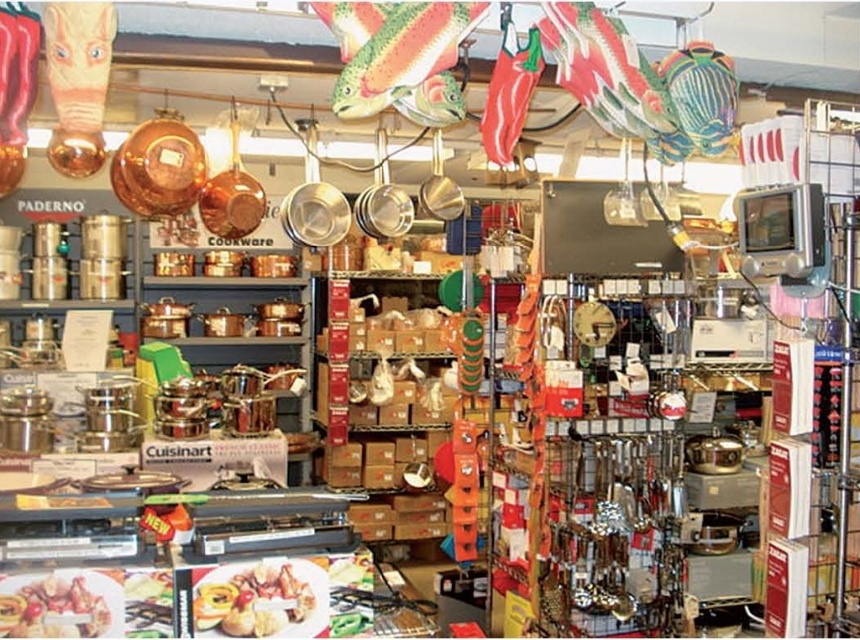
From the picture: You are a customer in the kitchenware store and want to pick up both the golden brown bread at center and the golden brown crispy chicken at center. Which item will you reach first?

The golden brown bread at center is closer to you than the golden brown crispy chicken at center, so you will reach the golden brown bread at center first.

Where is the golden brown bread at center located in the image?

The golden brown bread at center is located at point (259, 598) in the image.